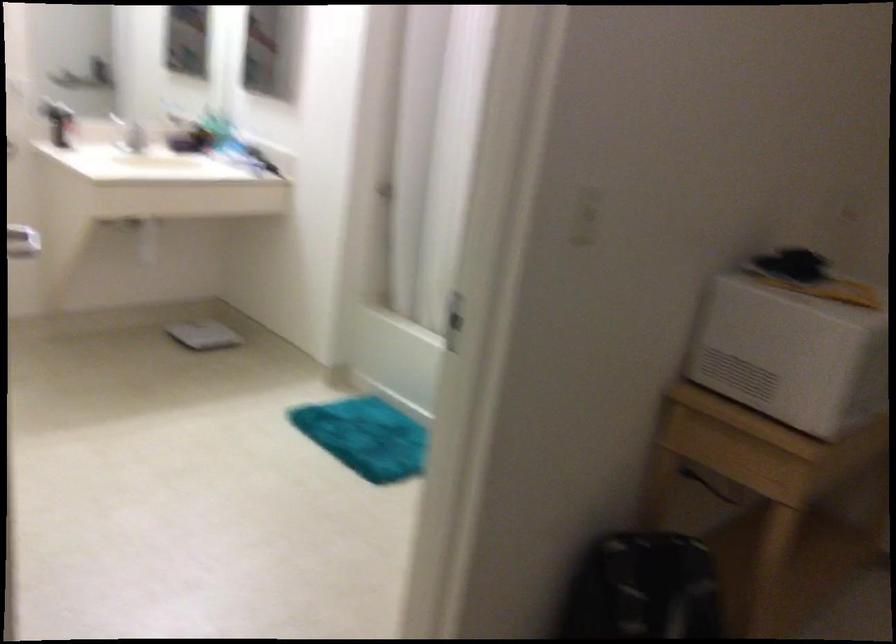
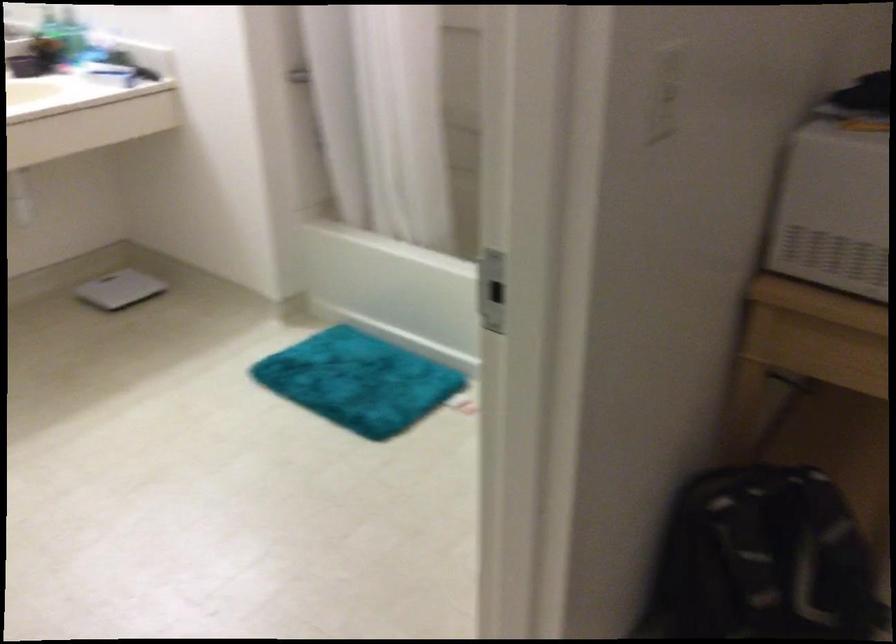
Where in the second image is the point corresponding to (202,333) from the first image?

(119, 289)